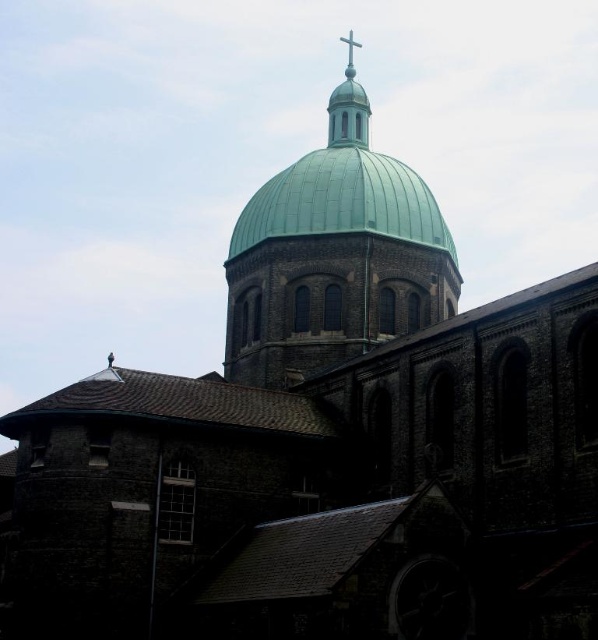
Is green dome at center above metallic cross at upper center?

Actually, green dome at center is below metallic cross at upper center.

What do you see at coordinates (334, 257) in the screenshot? Image resolution: width=598 pixels, height=640 pixels. I see `green dome at center` at bounding box center [334, 257].

This screenshot has width=598, height=640. What are the coordinates of `green dome at center` in the screenshot? It's located at (334, 257).

Where is `green dome at center`? green dome at center is located at coordinates (334, 257).